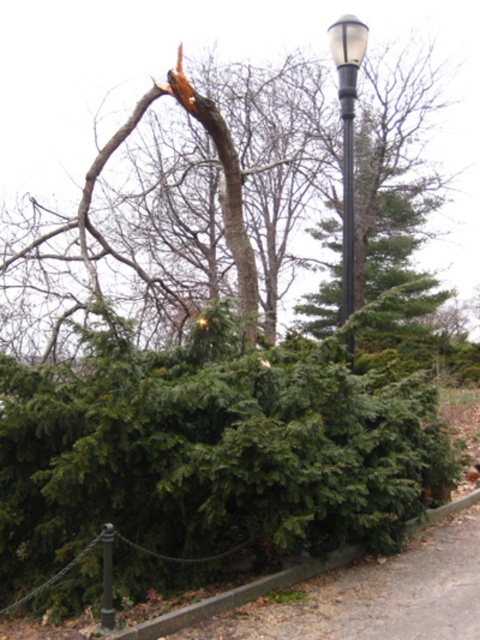
Is green leafy hedge at lower center above metallic gray pole at center?

No.

Is green leafy hedge at lower center thinner than metallic gray pole at center?

In fact, green leafy hedge at lower center might be wider than metallic gray pole at center.

Where is `green leafy hedge at lower center`? Image resolution: width=480 pixels, height=640 pixels. green leafy hedge at lower center is located at coordinates point(203,460).

Is point (250, 278) positioned behind point (348, 353)?

Yes, it is behind point (348, 353).

In the scene shown: Is brown rough bark tree at upper center to the left of metallic gray pole at center from the viewer's perspective?

Correct, you'll find brown rough bark tree at upper center to the left of metallic gray pole at center.

The height and width of the screenshot is (640, 480). Describe the element at coordinates (203, 163) in the screenshot. I see `brown rough bark tree at upper center` at that location.

You are a GUI agent. You are given a task and a screenshot of the screen. Output one action in this format:
    pyautogui.click(x=<x>, y=<y>)
    Task: Click on the brown rough bark tree at upper center
    
    Given the screenshot: What is the action you would take?
    pyautogui.click(x=203, y=163)

Does matte black streetlight at upper right have a lesser width compared to metallic gray pole at center?

No.

Which of these two, matte black streetlight at upper right or metallic gray pole at center, stands taller?

With more height is metallic gray pole at center.

The width and height of the screenshot is (480, 640). Identify the location of matte black streetlight at upper right. (348, 134).